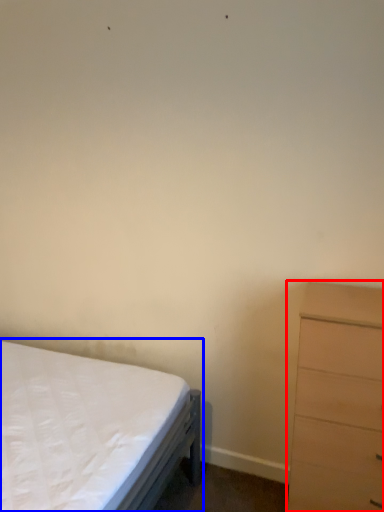
Question: Which object appears farthest to the camera in this image, chest of drawers (highlighted by a red box) or bed (highlighted by a blue box)?

Choices:
 (A) chest of drawers
 (B) bed

Answer: (A)